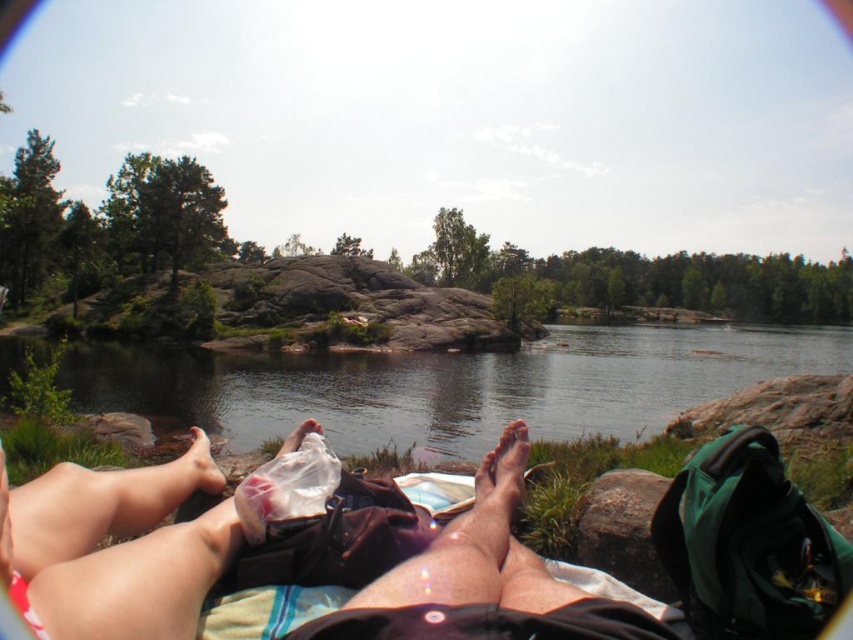
You are a hiker who wants to place the dry skin at center and the white matte plastic bag at lower center into your backpack. Which object should you place first if you want the taller one to be at the bottom?

The white matte plastic bag at lower center is taller than the dry skin at center, so you should place the white matte plastic bag at lower center first to ensure it is at the bottom.

You are packing for a day trip to the lakeside and have a rough textured rock at lower right and a white matte plastic bag at lower center in your backpack. You need to place both items on the rocky shoreline. Which item will have a smaller footprint on the ground?

The rough textured rock at lower right is thinner than the white matte plastic bag at lower center, so the rough textured rock at lower right will have a smaller footprint on the ground.

You are standing at the position of point (192, 488) and want to walk towards the water. Do you think point (556, 381) is in your path?

Point (556, 381) is behind point (192, 488), so it is not in your path towards the water.